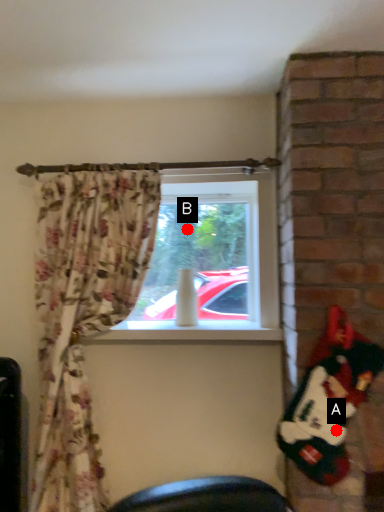
Question: Two points are circled on the image, labeled by A and B beside each circle. Which point is further to the camera?

Choices:
 (A) A is further
 (B) B is further

Answer: (B)